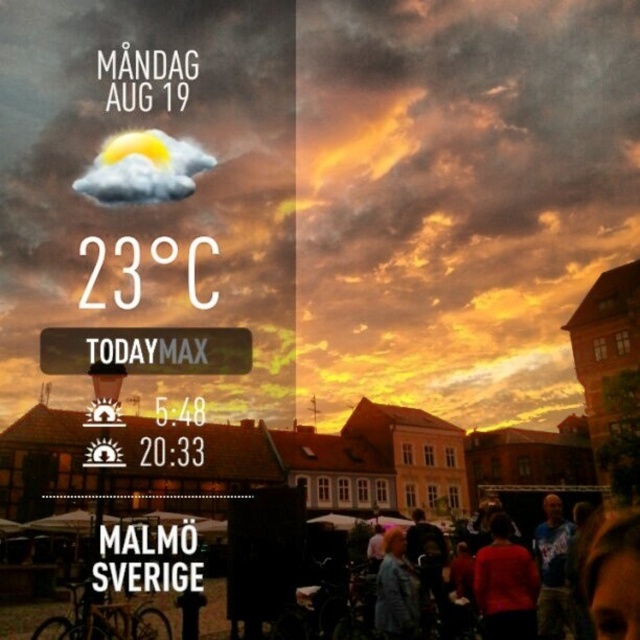
You are standing in a park and see both the matte orange sky at center and the white plastic sign at center. Which object is located to the right from your perspective?

The matte orange sky at center is to the right of the white plastic sign at center.

You are an astronomer analyzing the image. You notice the matte orange sky at center and the white plastic sign at center. Which object occupies a larger vertical space in the image?

The matte orange sky at center is much taller than the white plastic sign at center, so it occupies a larger vertical space in the image.

You are looking at the image and notice two points marked in the scene. Which point, point [168,461] or point [508,582], is closer to you?

Point [168,461] is closer to the viewer than point [508,582].